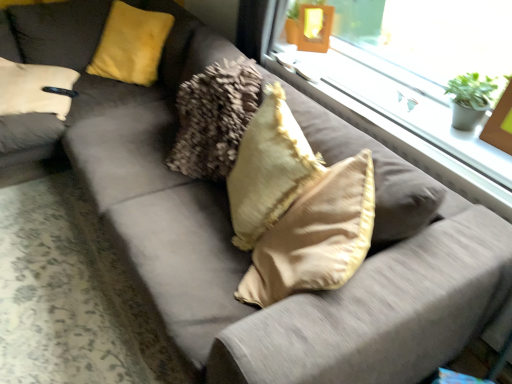
Question: From the image's perspective, is green matte houseplant at upper right below yellow fuzzy pillow at upper left, the first pillow positioned from the back?

Choices:
 (A) yes
 (B) no

Answer: (A)

Question: Can you confirm if green matte houseplant at upper right is wider than yellow fuzzy pillow at upper left, arranged as the first pillow when viewed from the left?

Choices:
 (A) yes
 (B) no

Answer: (B)

Question: From a real-world perspective, does green matte houseplant at upper right sit lower than yellow fuzzy pillow at upper left, which is counted as the 2th pillow, starting from the bottom?

Choices:
 (A) no
 (B) yes

Answer: (A)

Question: Considering the relative positions of green matte houseplant at upper right and yellow fuzzy pillow at upper left, arranged as the first pillow when viewed from the left, in the image provided, is green matte houseplant at upper right to the left of yellow fuzzy pillow at upper left, arranged as the first pillow when viewed from the left, from the viewer's perspective?

Choices:
 (A) no
 (B) yes

Answer: (A)

Question: Does green matte houseplant at upper right have a smaller size compared to yellow fuzzy pillow at upper left, which is counted as the 2th pillow, starting from the front?

Choices:
 (A) yes
 (B) no

Answer: (A)

Question: Is point (505, 137) closer or farther from the camera than point (480, 163)?

Choices:
 (A) closer
 (B) farther

Answer: (B)

Question: In the image, is wooden picture frame at upper right positioned in front of or behind clear glass window at upper right?

Choices:
 (A) front
 (B) behind

Answer: (A)

Question: In terms of height, does wooden picture frame at upper right look taller or shorter compared to clear glass window at upper right?

Choices:
 (A) short
 (B) tall

Answer: (B)

Question: Looking at their shapes, would you say wooden picture frame at upper right is wider or thinner than clear glass window at upper right?

Choices:
 (A) thin
 (B) wide

Answer: (A)

Question: In terms of width, does green matte houseplant at upper right look wider or thinner when compared to wooden picture frame at upper right?

Choices:
 (A) wide
 (B) thin

Answer: (A)

Question: Is green matte houseplant at upper right inside or outside of wooden picture frame at upper right?

Choices:
 (A) inside
 (B) outside

Answer: (B)

Question: Considering the relative positions of green matte houseplant at upper right and wooden picture frame at upper right in the image provided, is green matte houseplant at upper right to the left or to the right of wooden picture frame at upper right?

Choices:
 (A) left
 (B) right

Answer: (A)

Question: In terms of height, does green matte houseplant at upper right look taller or shorter compared to wooden picture frame at upper right?

Choices:
 (A) short
 (B) tall

Answer: (A)

Question: From a real-world perspective, is yellow fuzzy pillow at upper left, which is counted as the 2th pillow, starting from the bottom, physically located above or below wooden picture frame at upper right?

Choices:
 (A) below
 (B) above

Answer: (A)

Question: Does point (164, 34) appear closer or farther from the camera than point (493, 137)?

Choices:
 (A) closer
 (B) farther

Answer: (B)